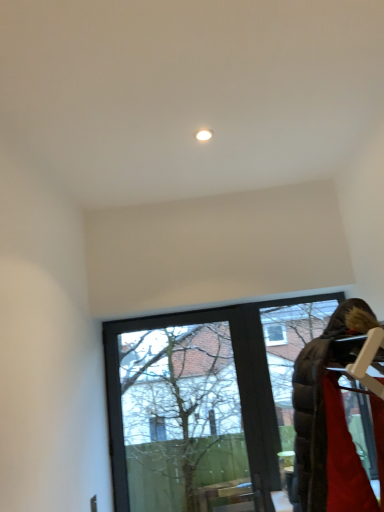
Question: In terms of width, does velvet brown coat at lower right look wider or thinner when compared to transparent glass window at center?

Choices:
 (A) wide
 (B) thin

Answer: (A)

Question: In terms of height, does velvet brown coat at lower right look taller or shorter compared to transparent glass window at center?

Choices:
 (A) short
 (B) tall

Answer: (A)

Question: Considering the positions of point (317, 398) and point (155, 394), is point (317, 398) closer or farther from the camera than point (155, 394)?

Choices:
 (A) closer
 (B) farther

Answer: (A)

Question: Based on their sizes in the image, would you say transparent glass window at center is bigger or smaller than velvet brown coat at lower right?

Choices:
 (A) big
 (B) small

Answer: (A)

Question: In the image, is transparent glass window at center on the left side or the right side of velvet brown coat at lower right?

Choices:
 (A) left
 (B) right

Answer: (A)

Question: From the image's perspective, is transparent glass window at center located above or below velvet brown coat at lower right?

Choices:
 (A) below
 (B) above

Answer: (A)

Question: In terms of height, does transparent glass window at center look taller or shorter compared to velvet brown coat at lower right?

Choices:
 (A) short
 (B) tall

Answer: (B)